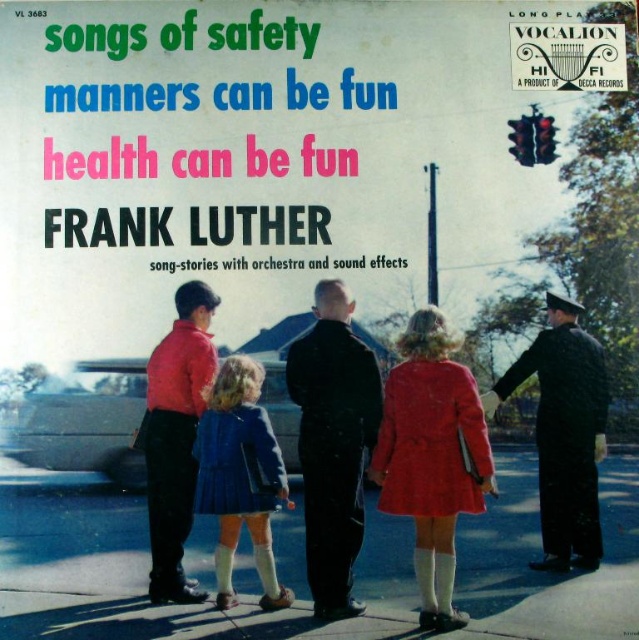
You are a child looking at the record cover and want to find the police officer. According to the image, where exactly is the matte black uniform at center located?

The matte black uniform at center is located at point 0.694 on the horizontal axis and 0.523 on the vertical axis.

You are standing at the center of the street scene depicted on the record cover. Looking around, you notice the blue woolen coat at center. Based on its position coordinates, can you determine if it is closer to the traffic light or the police officer?

The blue woolen coat at center is located at point [385,445]. Without specific coordinates for the traffic light or police officer, it is impossible to determine its proximity to either.

You are a photographer trying to capture a clear shot of both the black uniform at right and the red paper sign at upper right. Which object will require a wider lens aperture to focus on due to its size?

The black uniform at right has a greater width than the red paper sign at upper right, so it will require a wider lens aperture to focus on due to its larger size.